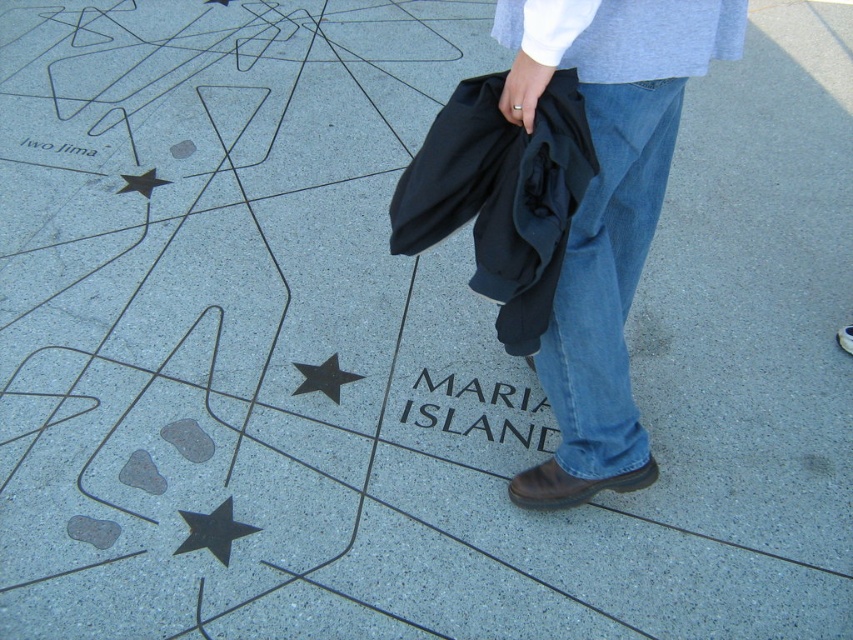
You are a tour guide explaining the memorial site to visitors. You point to the metallic star at center and the black paper at center. Which object is smaller in width?

The metallic star at center has a lesser width compared to the black paper at center, so the metallic star at center is smaller in width.

You are a photographer trying to capture the IWO JIMA inscription on the pavement. You are standing at the denim jeans at center. Where should you position your camera to ensure the inscription is fully visible in the frame?

The denim jeans at center is located at point (606, 209). To capture the IWO JIMA inscription, you should position your camera so that the center of the frame aligns with the denim jeans at center, ensuring the inscription near the star is within the view.

You are a fashion designer observing the person in the image. You need to determine which clothing item has a wider width between the denim at center and the gray cotton sweatshirt at upper center. Which one is wider?

The gray cotton sweatshirt at upper center has a greater width compared to the denim at center.